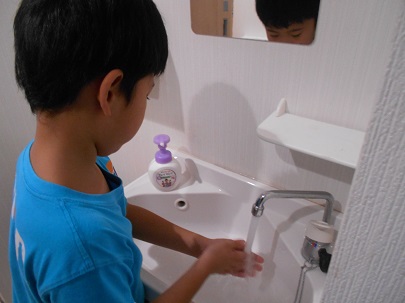
This screenshot has width=405, height=303. Identify the location of basin. (220, 225).